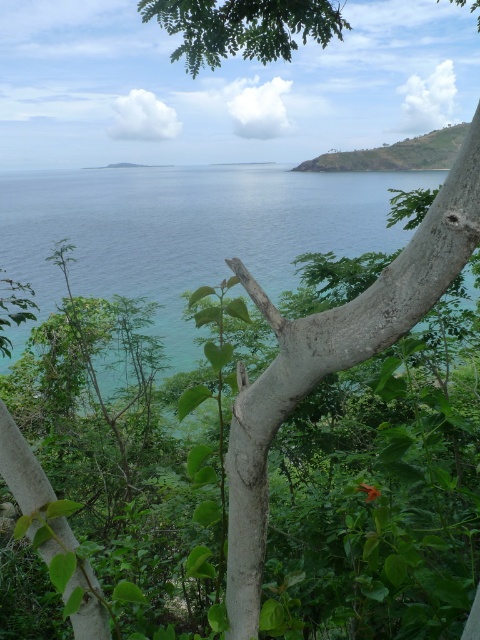
In the scene shown: You are standing in a coastal area surrounded by greenery and see the green water at center and the green rough bark tree at center. Which object is located to the left of the other?

The green water at center is positioned on the left side of green rough bark tree at center.

You are a hiker standing at the base of the green rough bark tree at center and want to reach the green grassy hill at upper right. Which direction should you move to get closer to the hill?

The green grassy hill at upper right is taller than the green rough bark tree at center, so you should move towards the upper right direction to get closer to the hill.

You are standing at the base of the tree trunk with rough light colored bark in the foreground. You want to reach the point marked at coordinates (189, 230). Which direction should you walk to get there?

You should walk towards the center of the image because the point (189, 230) is on green water at center.